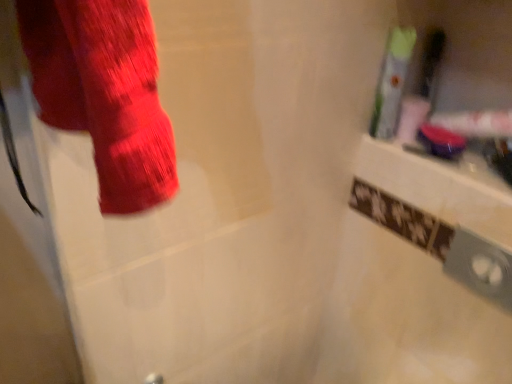
Question: Is green plastic toothbrush at upper right, acting as the 2th toiletry starting from the right, in front of or behind translucent plastic toothbrush at upper right, which is counted as the 2th toiletry, starting from the left, in the image?

Choices:
 (A) front
 (B) behind

Answer: (A)

Question: From the image's perspective, is green plastic toothbrush at upper right, the 1th toiletry in the left-to-right sequence, above or below translucent plastic toothbrush at upper right, which is counted as the 2th toiletry, starting from the left?

Choices:
 (A) below
 (B) above

Answer: (A)

Question: Is green plastic toothbrush at upper right, acting as the 2th toiletry starting from the right, taller or shorter than translucent plastic toothbrush at upper right, the 1th toiletry when ordered from right to left?

Choices:
 (A) short
 (B) tall

Answer: (B)

Question: From the image's perspective, is translucent plastic toothbrush at upper right, which is counted as the 2th toiletry, starting from the left, located above or below green plastic toothbrush at upper right, the 1th toiletry in the left-to-right sequence?

Choices:
 (A) above
 (B) below

Answer: (A)

Question: Based on their sizes in the image, would you say translucent plastic toothbrush at upper right, the 1th toiletry when ordered from right to left, is bigger or smaller than green plastic toothbrush at upper right, acting as the 2th toiletry starting from the right?

Choices:
 (A) small
 (B) big

Answer: (A)

Question: From their relative heights in the image, would you say translucent plastic toothbrush at upper right, the 1th toiletry when ordered from right to left, is taller or shorter than green plastic toothbrush at upper right, the 1th toiletry in the left-to-right sequence?

Choices:
 (A) short
 (B) tall

Answer: (A)

Question: Is translucent plastic toothbrush at upper right, which is counted as the 2th toiletry, starting from the left, inside the boundaries of green plastic toothbrush at upper right, acting as the 2th toiletry starting from the right, or outside?

Choices:
 (A) inside
 (B) outside

Answer: (B)